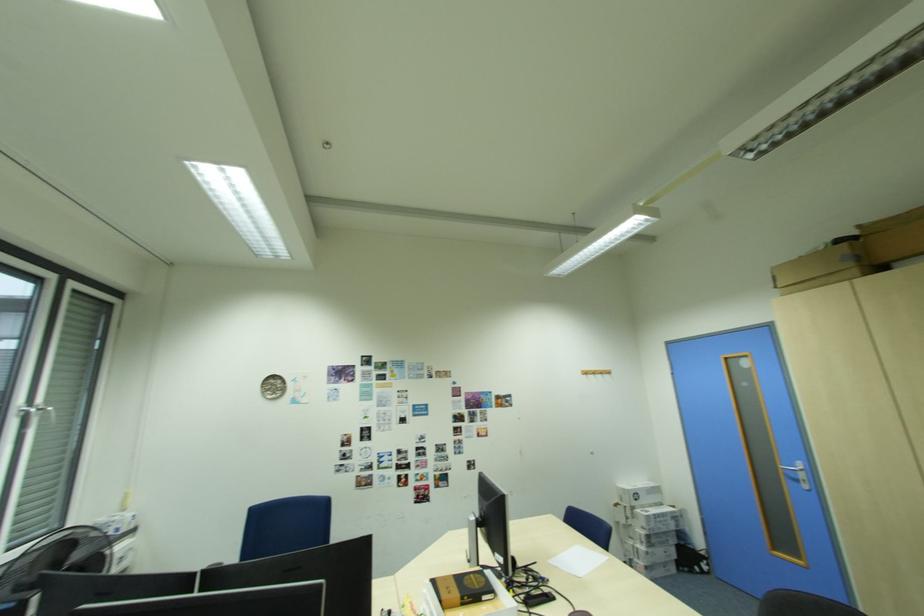
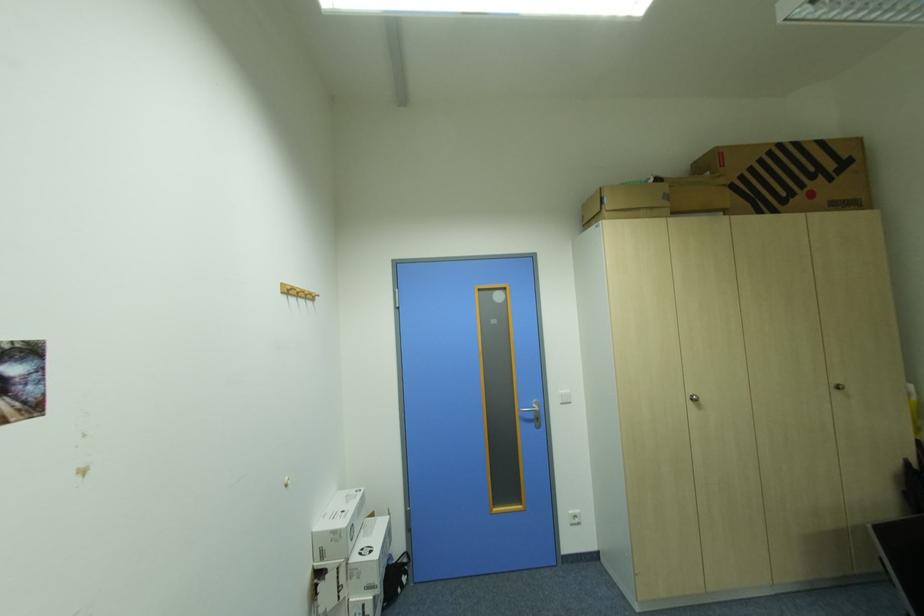
In the second image, find the point that corresponds to [590,375] in the first image.

(292, 293)